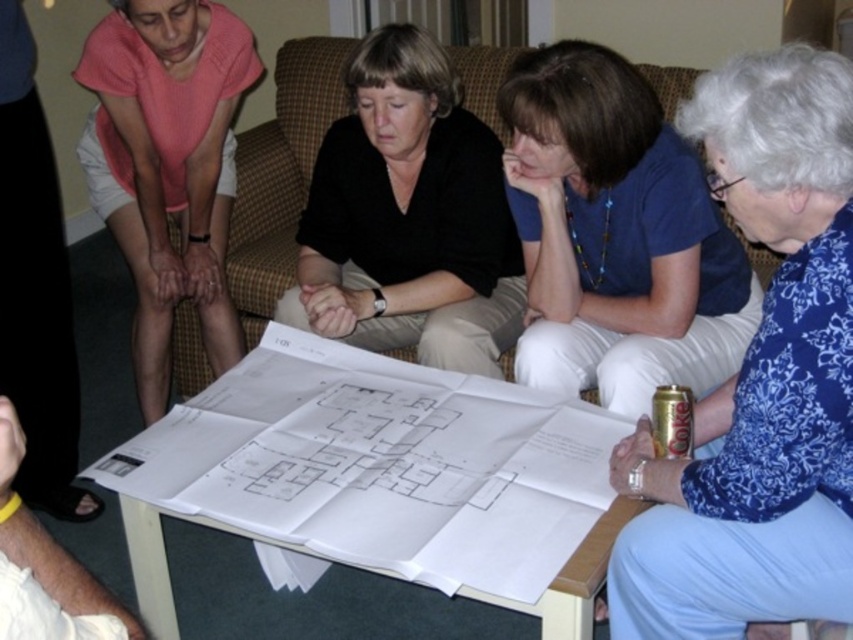
Who is positioned more to the left, white paper at center or black matte shirt at center?

Positioned to the left is black matte shirt at center.

Is white paper at center thinner than black matte shirt at center?

Incorrect, white paper at center's width is not less than black matte shirt at center's.

Does point (410, 452) come closer to viewer compared to point (320, 268)?

Yes, point (410, 452) is closer to viewer.

The image size is (853, 640). In order to click on white paper at center in this screenshot , I will do `click(381, 477)`.

Is blue floral blouse at lower right above blue fabric shirt at center?

Incorrect, blue floral blouse at lower right is not positioned above blue fabric shirt at center.

Is the position of blue floral blouse at lower right more distant than that of blue fabric shirt at center?

No, it is not.

Is point (767, 81) in front of point (685, 218)?

Yes, it is.

Locate an element on the screen. This screenshot has width=853, height=640. blue floral blouse at lower right is located at coordinates (759, 380).

Does white paper at center lie in front of pink cotton shirt at upper left?

Yes.

Who is positioned more to the right, white paper at center or pink cotton shirt at upper left?

white paper at center

What do you see at coordinates (381, 477) in the screenshot? Image resolution: width=853 pixels, height=640 pixels. I see `white paper at center` at bounding box center [381, 477].

Locate an element on the screen. The height and width of the screenshot is (640, 853). white paper at center is located at coordinates (381, 477).